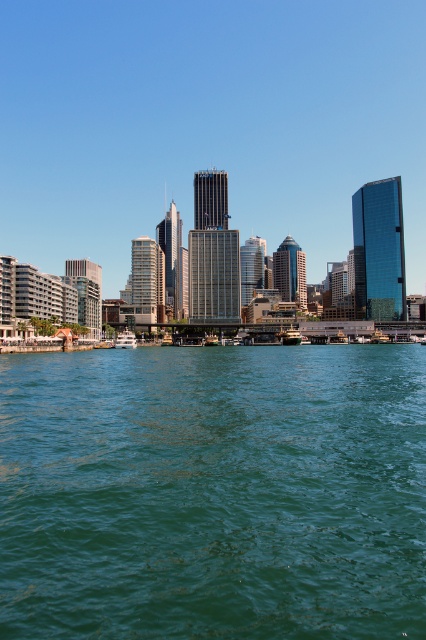
Is green water at lower center taller than white glossy boat at center?

Indeed, green water at lower center has a greater height compared to white glossy boat at center.

Between green water at lower center and white glossy boat at center, which one is positioned higher?

white glossy boat at center

Where is `green water at lower center`? Image resolution: width=426 pixels, height=640 pixels. green water at lower center is located at coordinates (213, 493).